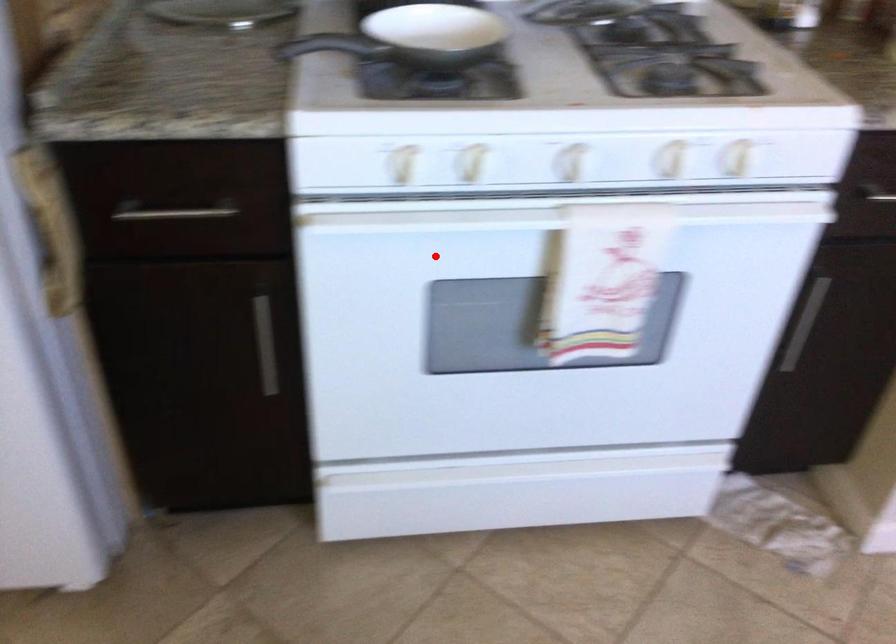
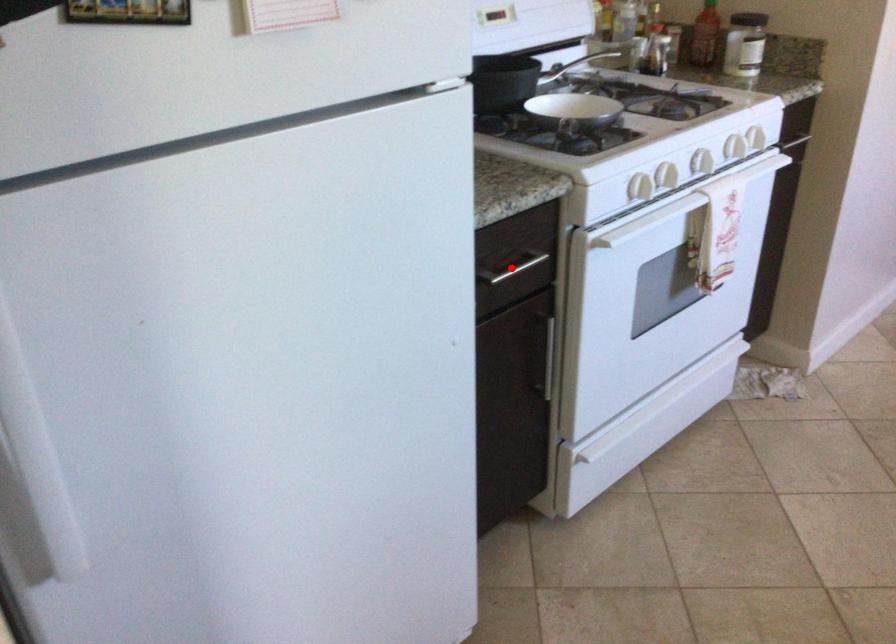
I am providing you with two images of the same scene from different viewpoints. A red point is marked on the first image and another point is marked on the second image. Is the marked point in image1 the same physical position as the marked point in image2?

No